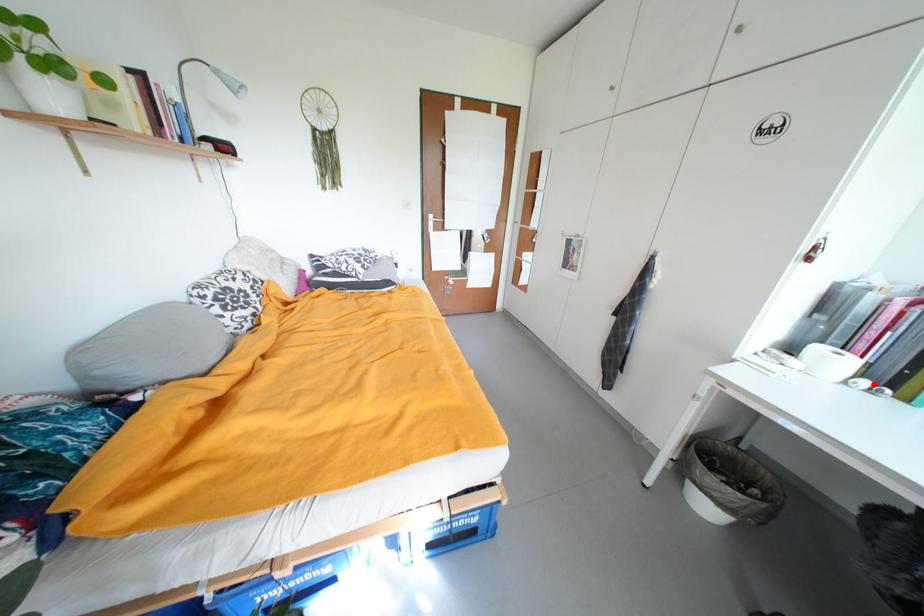
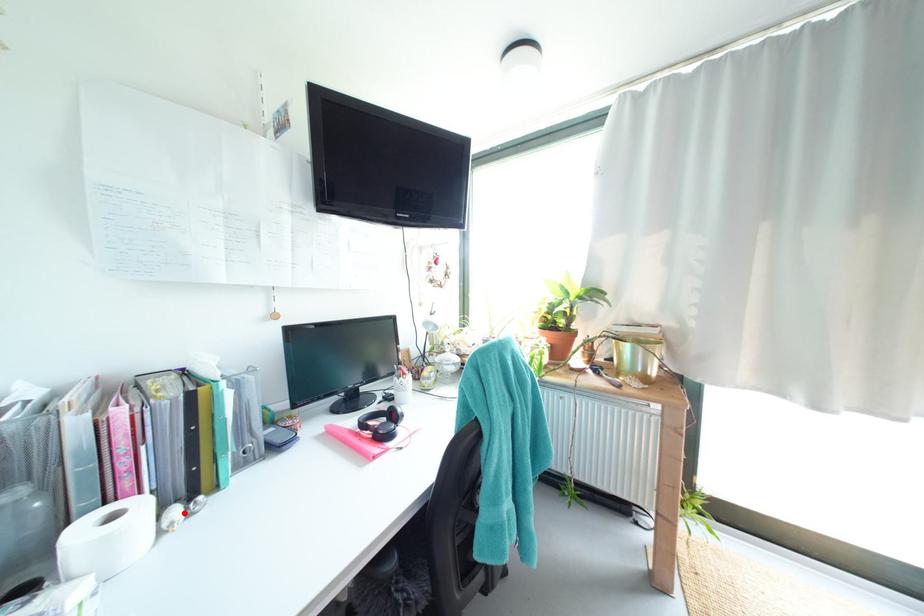
I am providing you with two images of the same scene from different viewpoints. A red point is marked on the first image and another point is marked on the second image. Are the points marked in image1 and image2 representing the same 3D position?

Yes